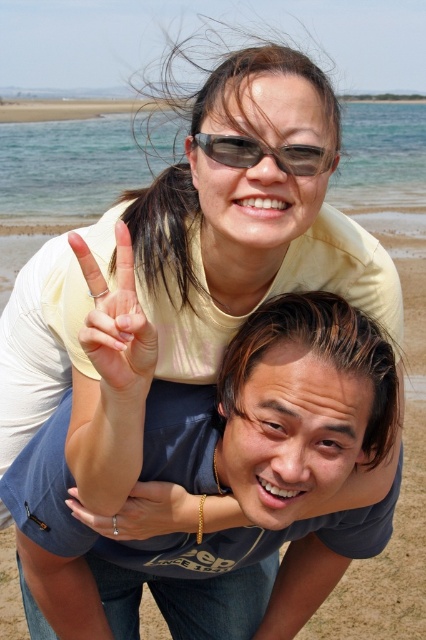
Looking at this image, between matte yellow hand at center and silver metallic ring at center, which one has more height?

matte yellow hand at center is taller.

Who is higher up, matte yellow hand at center or silver metallic ring at center?

Positioned higher is matte yellow hand at center.

Between point (88, 266) and point (181, 518), which one is positioned in front?

Point (88, 266) is in front.

This screenshot has width=426, height=640. What are the coordinates of `matte yellow hand at center` in the screenshot? It's located at pos(115,317).

Who is shorter, blue cotton shirt at center or matte yellow hand at center?

Standing shorter between the two is matte yellow hand at center.

Which is more to the left, blue cotton shirt at center or matte yellow hand at center?

matte yellow hand at center is more to the left.

Is point (172, 433) positioned behind point (121, 384)?

That is True.

Locate an element on the screen. The height and width of the screenshot is (640, 426). blue cotton shirt at center is located at coordinates (224, 477).

Is blue cotton shirt at center in front of matte black sunglasses at upper center?

Yes, it is.

Can you confirm if blue cotton shirt at center is taller than matte black sunglasses at upper center?

Correct, blue cotton shirt at center is much taller as matte black sunglasses at upper center.

Identify the location of blue cotton shirt at center. This screenshot has height=640, width=426. (224, 477).

I want to click on blue cotton shirt at center, so click(224, 477).